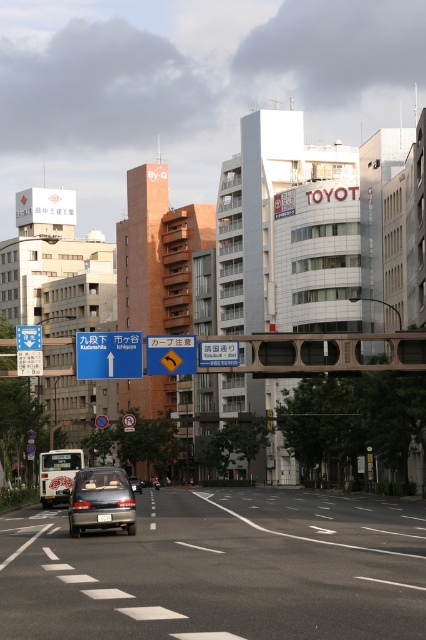
You are a pedestrian standing at the edge of the road and want to read the yellow reflective text at center. There is a yellow plastic traffic sign at center in the way. Can you walk around it to reach the text?

The yellow plastic traffic sign at center is 4.23 feet from the yellow reflective text at center. Since the distance between them is sufficient, you can walk around the sign to reach the text.

Looking at this image, you are a delivery driver needing to deliver a package to the blue plastic sign at upper center. Your truck is parked next to the matte silver sedan at center. Can you reach the sign without moving the sedan?

The blue plastic sign at upper center is 7.66 meters away from the matte silver sedan at center. Since the distance is sufficient, you can reach the sign without moving the sedan as the truck can maneuver around the sedan within that distance.

You are a delivery drone flying above the city. Your GPS shows a point at coordinates (325, 353). What object is located at that point?

The point at coordinates (325, 353) marks the metallic gray bridge at center.